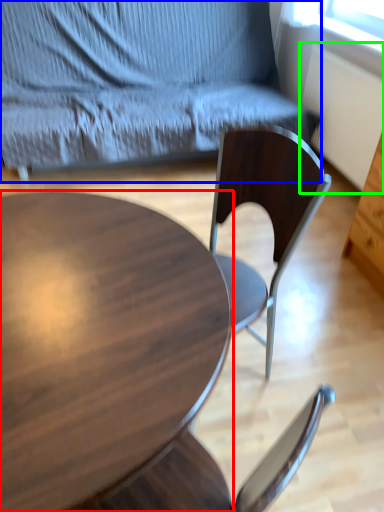
Question: Based on their relative distances, which object is nearer to coffee table (highlighted by a red box)? Choose from chair (highlighted by a blue box) and radiator (highlighted by a green box).

Choices:
 (A) chair
 (B) radiator

Answer: (A)